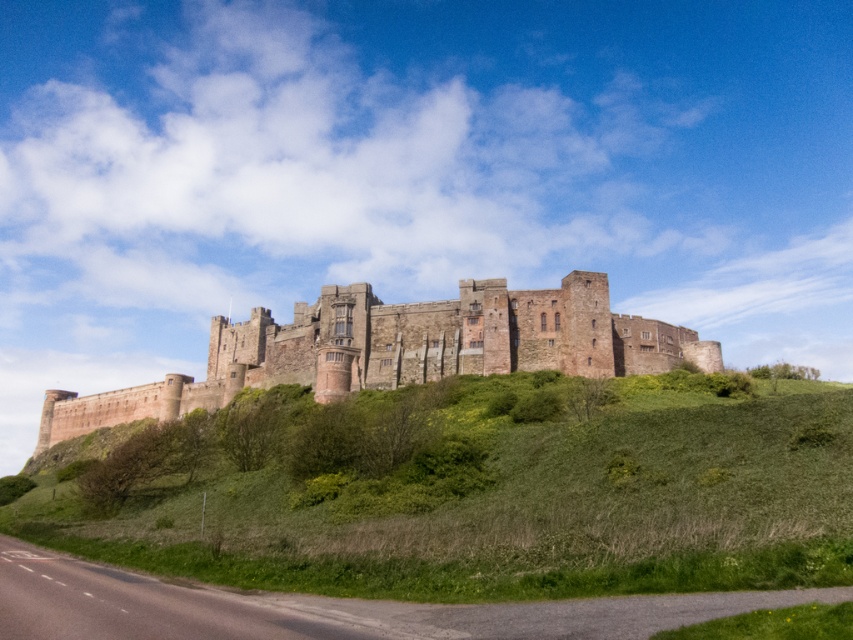
Based on the photo, you are a knight approaching the castle from the road below. As you look up, which object is closer to you between the green grassy hillside at center and the brown stone castle at center?

The green grassy hillside at center is closer to you because it is positioned in front of the brown stone castle at center.

You are a knight approaching the castle and need to decide whether to climb the green grassy hillside at center or go around the brown stone castle at center. Which path would be shorter in distance?

The green grassy hillside at center is shorter than the brown stone castle at center, so climbing the hillside would be the shorter path.

You are a knight approaching the brown stone castle at center from the east. As you walk towards it, which direction should you look to see the green grassy hillside at center?

Since the green grassy hillside at center is to the right of the brown stone castle at center, you should look to your right as you approach the castle from the east to see the green grassy hillside at center.